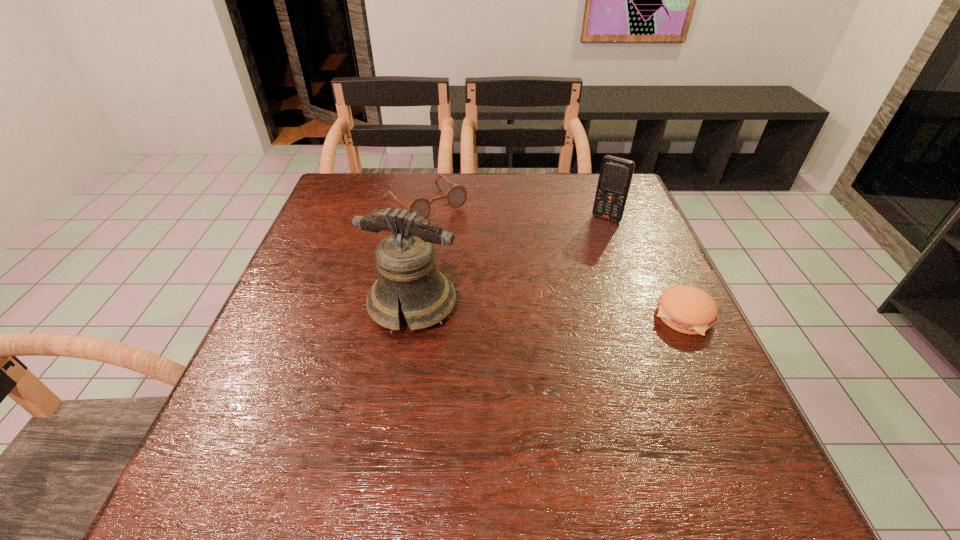
The image size is (960, 540). Find the location of `vacant area that lies between the cellular telephone and the third tallest object`. vacant area that lies between the cellular telephone and the third tallest object is located at coordinates (516, 210).

The height and width of the screenshot is (540, 960). In order to click on free space that is in between the second shortest object and the cellular telephone in this screenshot , I will do `click(516, 210)`.

Identify which object is the third closest to the patty. Please provide its 2D coordinates. Your answer should be formatted as a tuple, i.e. [(x, y)], where the tuple contains the x and y coordinates of a point satisfying the conditions above.

[(456, 196)]

Choose which object is the third nearest neighbor to the cellular telephone. Please provide its 2D coordinates. Your answer should be formatted as a tuple, i.e. [(x, y)], where the tuple contains the x and y coordinates of a point satisfying the conditions above.

[(407, 273)]

Locate an element on the screen. free space that satisfies the following two spatial constraints: 1. on the front side of the shortest object; 2. on the left side of the bell is located at coordinates (411, 316).

Find the location of a particular element. This screenshot has width=960, height=540. free space that satisfies the following two spatial constraints: 1. on the front side of the patty; 2. on the left side of the tallest object is located at coordinates (411, 316).

Where is `free location that satisfies the following two spatial constraints: 1. on the front side of the bell; 2. on the left side of the spectacles`? The height and width of the screenshot is (540, 960). free location that satisfies the following two spatial constraints: 1. on the front side of the bell; 2. on the left side of the spectacles is located at coordinates (407, 305).